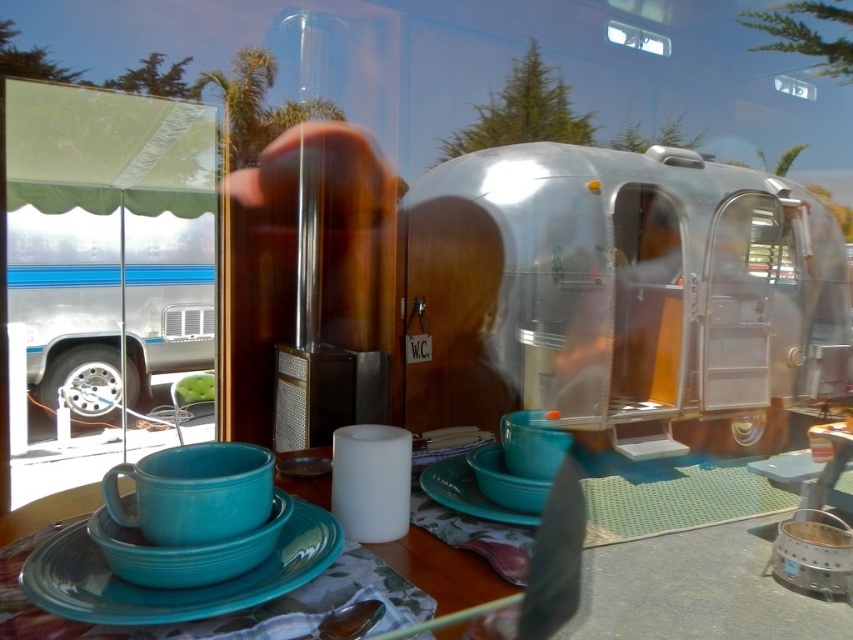
This screenshot has height=640, width=853. I want to click on teal ceramic plate at center, so click(x=172, y=588).

In the scene shown: Does teal ceramic plate at center appear under matte blue plate at center?

Yes.

Describe the element at coordinates (172, 588) in the screenshot. I see `teal ceramic plate at center` at that location.

At what (x,y) coordinates should I click in order to perform the action: click on teal ceramic plate at center. Please return your answer as a coordinate pair (x, y). Image resolution: width=853 pixels, height=640 pixels. Looking at the image, I should click on (172, 588).

From the picture: Is teal ceramic tableware at center closer to camera compared to matte blue plate at center?

Yes, teal ceramic tableware at center is in front of matte blue plate at center.

This screenshot has height=640, width=853. I want to click on teal ceramic tableware at center, so click(442, 568).

Who is more distant from viewer, [457,584] or [421,483]?

Point [421,483]

Find the location of `teal ceramic tableware at center`. teal ceramic tableware at center is located at coordinates (442, 568).

Looking at this image, how far apart are teal matte saucer at center and matte blue plate at center?

teal matte saucer at center and matte blue plate at center are 11.75 inches apart.

Which of these two, teal matte saucer at center or matte blue plate at center, stands shorter?

With less height is matte blue plate at center.

Which is in front, point (115, 544) or point (447, 497)?

Point (115, 544) is in front.

Locate an element on the screen. This screenshot has height=640, width=853. teal matte saucer at center is located at coordinates (184, 552).